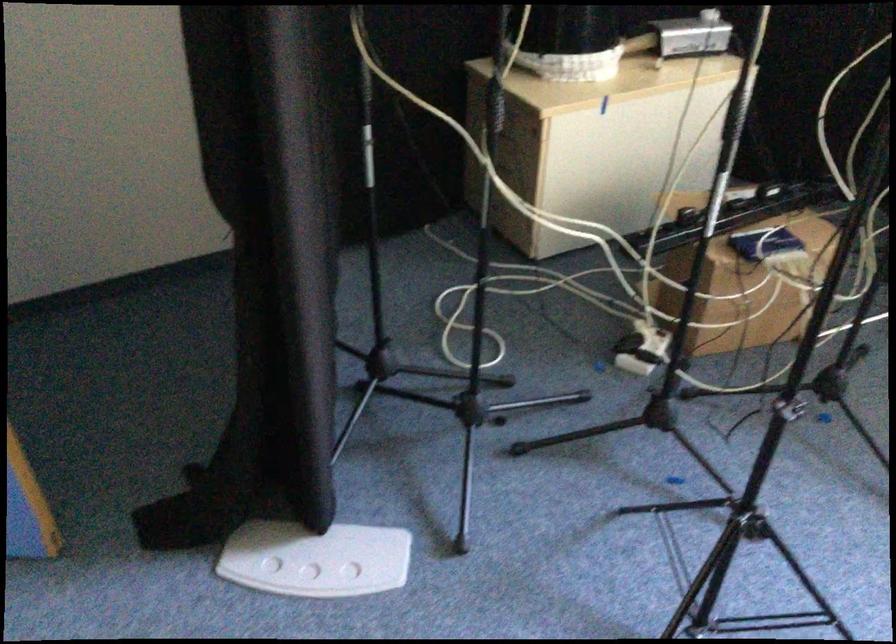
Find where to lift the silver electronics box. Please return your answer as a coordinate pair (x, y).

(692, 35)